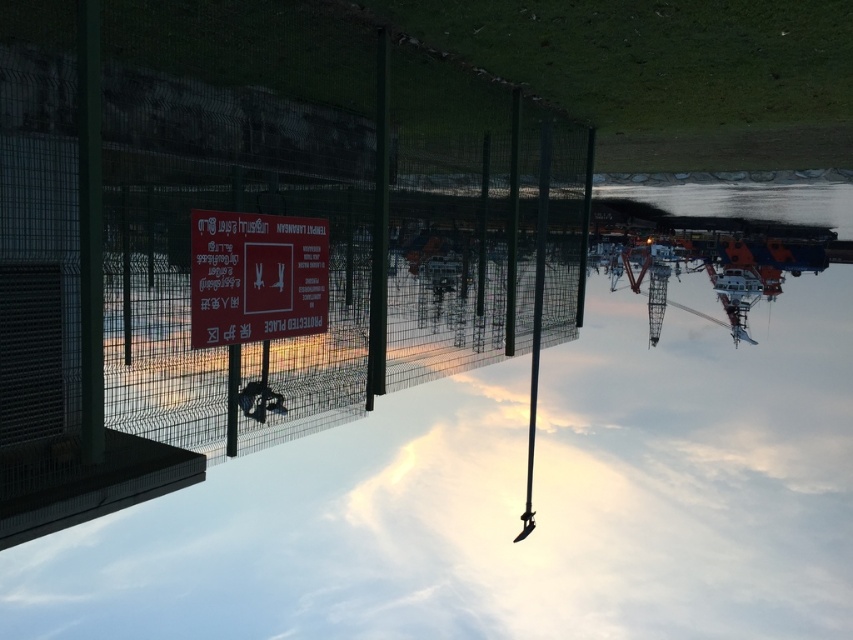
You are standing in the port area and want to approach the green wire mesh fence at center. Given that you are 5.99 meters away from it, is the distance within a comfortable walking range?

Yes, the distance between you and the green wire mesh fence at center is 5.99 meters, which is a comfortable walking distance.

You are a security guard patrolling the perimeter of the port. You notice the green wire mesh fence at center and the matte red sign at center. According to the scene, which object is positioned to the left of the other?

The green wire mesh fence at center is to the left of the matte red sign at center.